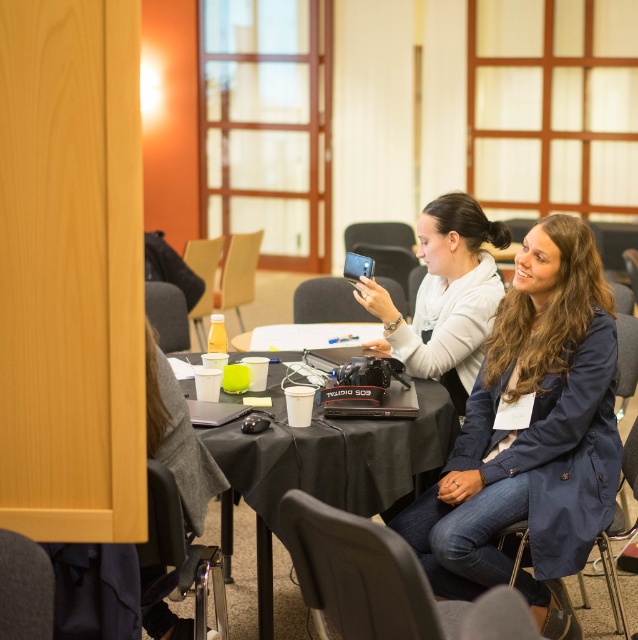
Is point (366, 280) positioned behind point (338, 280)?

No, (366, 280) is in front of (338, 280).

Does matte black camera at center have a smaller size compared to matte black chair at center?

Actually, matte black camera at center might be larger than matte black chair at center.

Locate an element on the screen. matte black camera at center is located at coordinates (443, 296).

Which is below, matte black chair at center or navy blue fabric chair at lower right?

Positioned lower is navy blue fabric chair at lower right.

Is matte black chair at center wider than navy blue fabric chair at lower right?

Correct, the width of matte black chair at center exceeds that of navy blue fabric chair at lower right.

Where is `matte black chair at center`? The image size is (638, 640). matte black chair at center is located at coordinates (327, 301).

In order to click on matte black chair at center in this screenshot , I will do `click(327, 301)`.

Can you confirm if black fabric table at center is smaller than matte gray chair at lower center?

No.

Is point (288, 461) behind point (417, 573)?

That is True.

Locate an element on the screen. Image resolution: width=638 pixels, height=640 pixels. black fabric table at center is located at coordinates (332, 464).